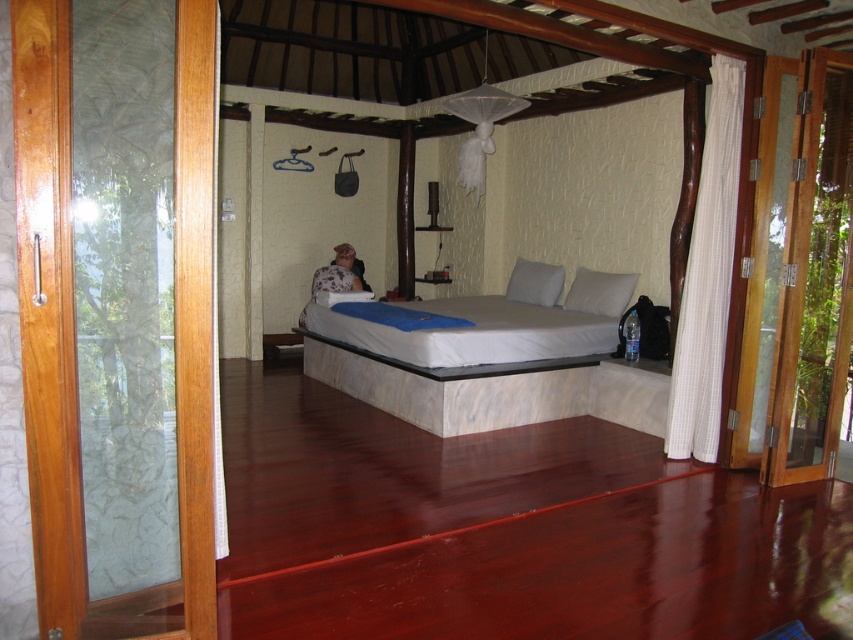
You are standing in the bedroom and want to exit through the transparent glass door at left. However, there is a white matte pillow at center in the way. To reach the door, do you need to move the pillow to your right or left?

The transparent glass door at left is positioned on the left side of white matte pillow at center, so you need to move the pillow to your right to reach the door.

You are moving a large painting that is 1.2 meters wide. You want to place it on the wall near the transparent glass door at left and the white matte pillow at center. Which object can the painting fit next to without exceeding its width?

The transparent glass door at left is wider than the white matte pillow at center, so the painting can fit next to the transparent glass door at left since its width is greater than 1.2 meters.

Consider the image. You are standing in the bedroom and want to exit through the transparent glass door at left. Which direction should you move relative to the white matte pillow at center?

The transparent glass door at left is below the white matte pillow at center, so you should move downward from the white matte pillow at center to reach the transparent glass door at left.